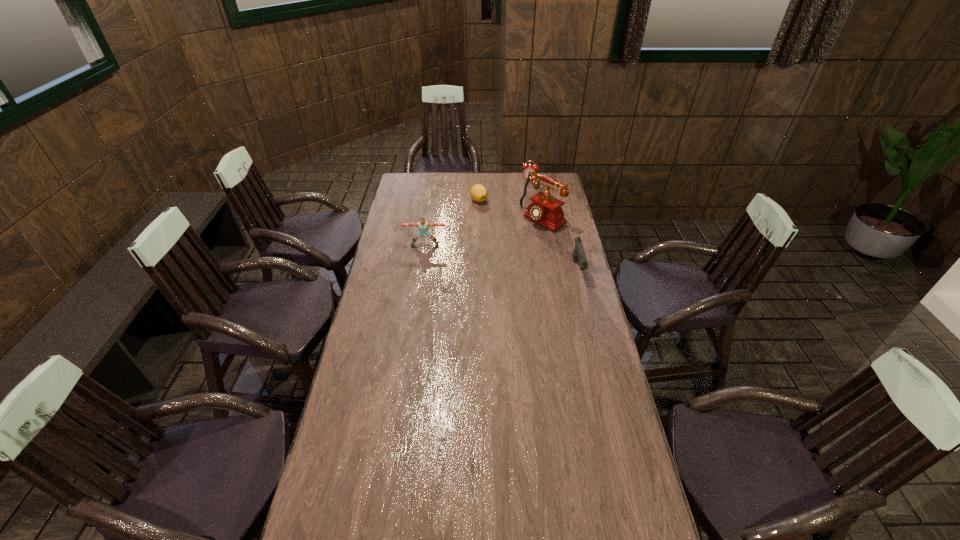
The image size is (960, 540). I want to click on vacant spot on the desktop that is between the puncher and the nearest object and is positioned at the stem end of the lemon, so click(x=481, y=254).

The image size is (960, 540). What are the coordinates of `free space on the desktop that is between the leftmost object and the pistol and is positioned on the face of the farthest object` in the screenshot? It's located at (498, 256).

At what (x,y) coordinates should I click in order to perform the action: click on vacant space on the desktop that is between the second nearest object and the nearest object and is positioned on the dial of the third nearest object. Please return your answer as a coordinate pair (x, y). The height and width of the screenshot is (540, 960). Looking at the image, I should click on (489, 255).